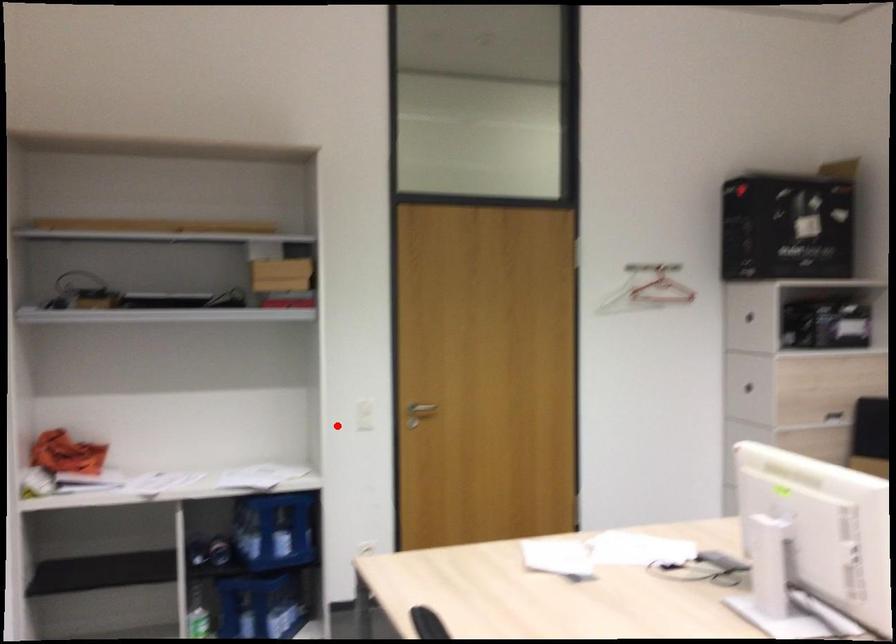
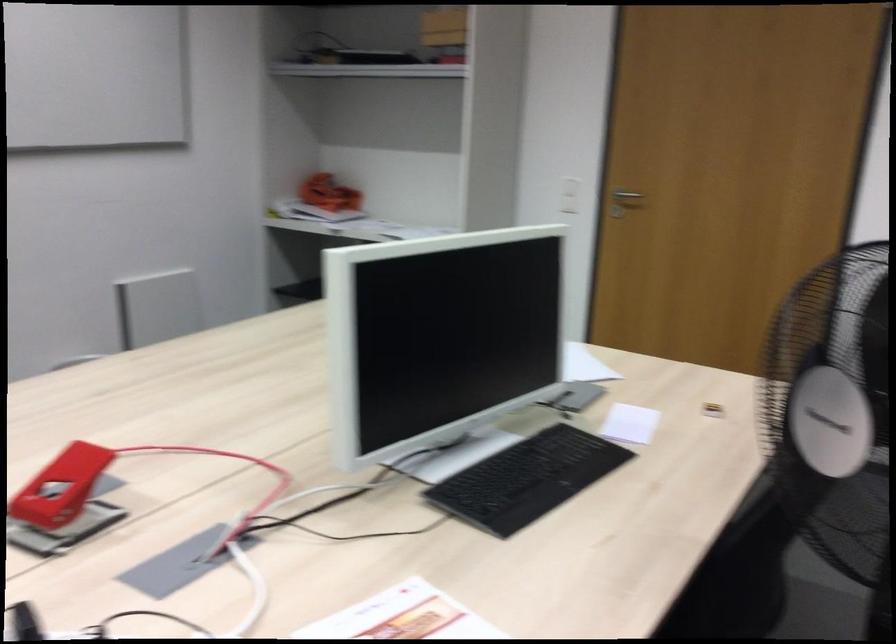
In the second image, find the point that corresponds to the highlighted location in the first image.

(569, 194)